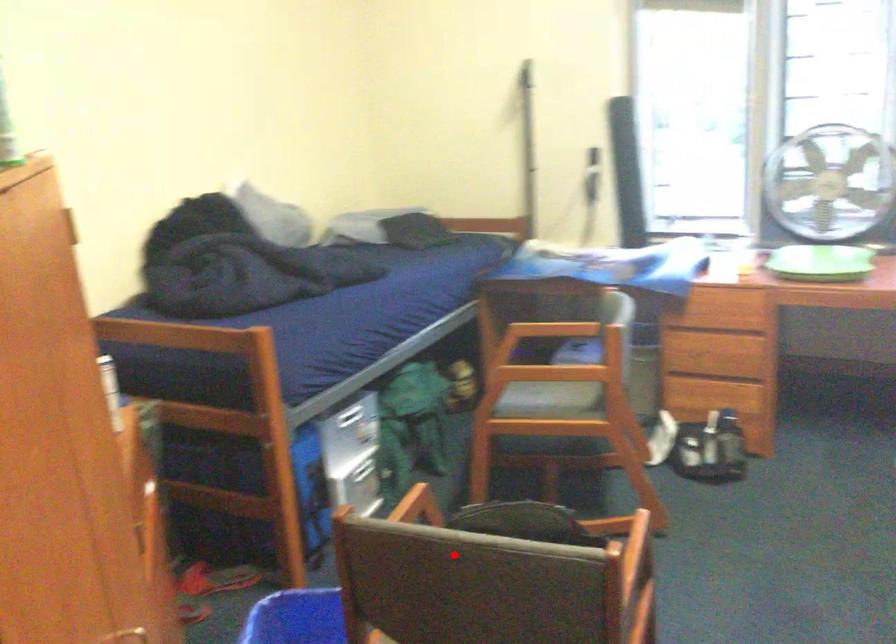
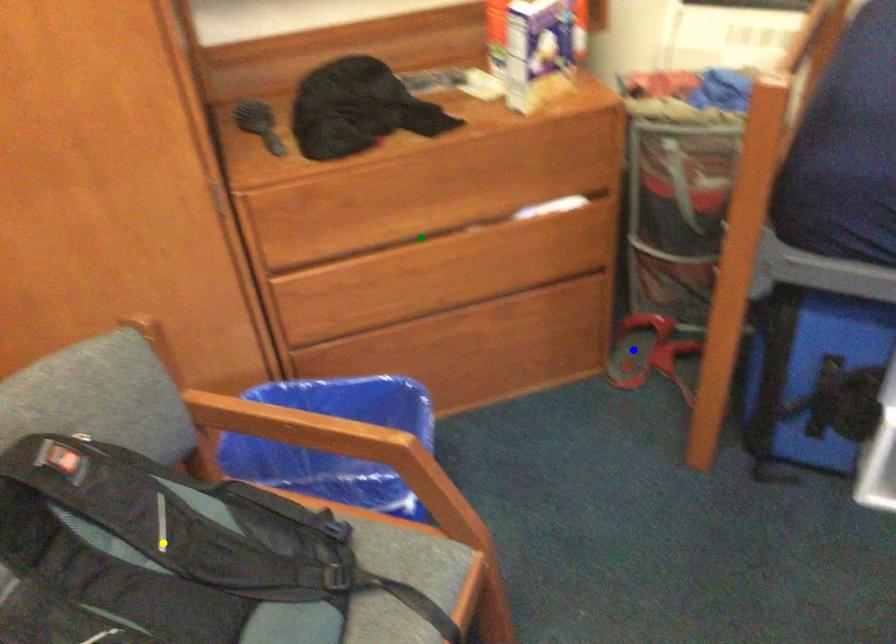
Question: I am providing you with two images of the same scene from different viewpoints. A red point is marked on the first image. You are given multiple points on the second image. Can you choose the point in image 2 that corresponds to the point in image 1?

Choices:
 (A) yellow point
 (B) green point
 (C) blue point

Answer: (A)